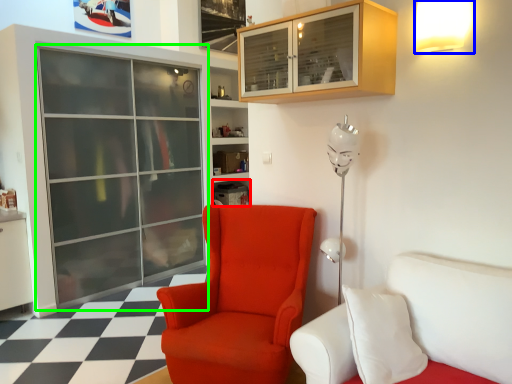
Question: Which is farther away from shelf (highlighted by a red box)? light fixture (highlighted by a blue box) or screen door (highlighted by a green box)?

Choices:
 (A) light fixture
 (B) screen door

Answer: (A)